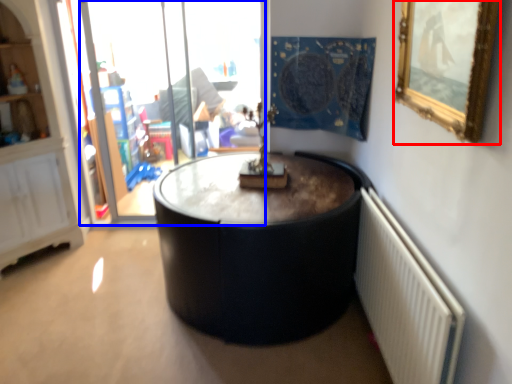
Question: Which object is further to the camera taking this photo, picture frame (highlighted by a red box) or glass door (highlighted by a blue box)?

Choices:
 (A) picture frame
 (B) glass door

Answer: (B)